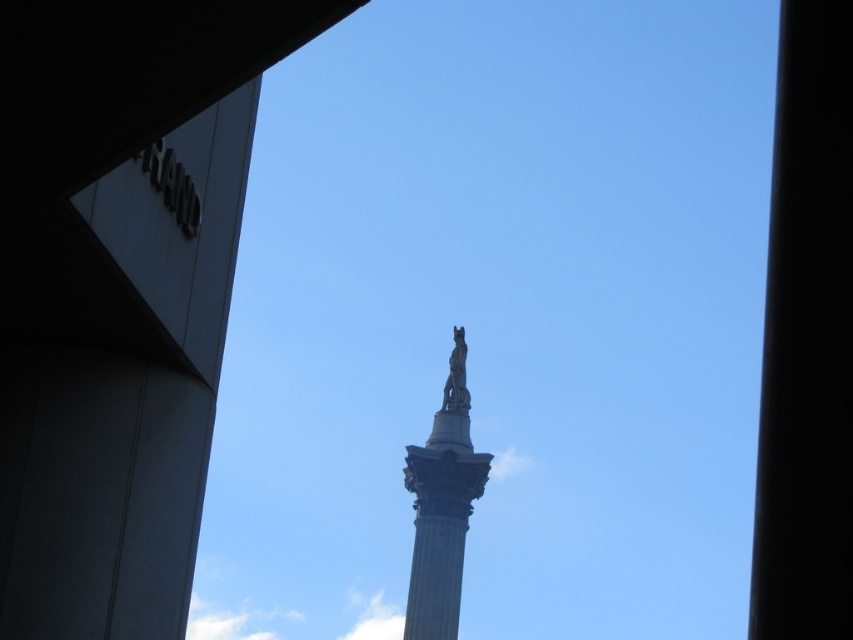
Which of these two, black marble column at center or polished bronze statue at center, stands taller?

black marble column at center is taller.

Does black marble column at center come in front of polished bronze statue at center?

Yes, it is.

Is point (769, 225) behind point (456, 346)?

No, it is in front of (456, 346).

This screenshot has height=640, width=853. Find the location of `black marble column at center`. black marble column at center is located at coordinates (807, 339).

Who is taller, polished stone column at center or polished bronze statue at center?

Standing taller between the two is polished stone column at center.

This screenshot has width=853, height=640. Find the location of `polished stone column at center`. polished stone column at center is located at coordinates (x=442, y=506).

I want to click on polished stone column at center, so click(x=442, y=506).

Locate an element on the screen. This screenshot has height=640, width=853. polished stone column at center is located at coordinates (442, 506).

Does polished stone column at upper center have a greater width compared to polished bronze statue at center?

Indeed, polished stone column at upper center has a greater width compared to polished bronze statue at center.

The height and width of the screenshot is (640, 853). Describe the element at coordinates (119, 292) in the screenshot. I see `polished stone column at upper center` at that location.

Between point (113, 296) and point (448, 356), which one is positioned behind?

The point (448, 356) is more distant.

You are a GUI agent. You are given a task and a screenshot of the screen. Output one action in this format:
    pyautogui.click(x=<x>, y=<y>)
    Task: Click on the polished stone column at upper center
    The width and height of the screenshot is (853, 640).
    Given the screenshot: What is the action you would take?
    pyautogui.click(x=119, y=292)